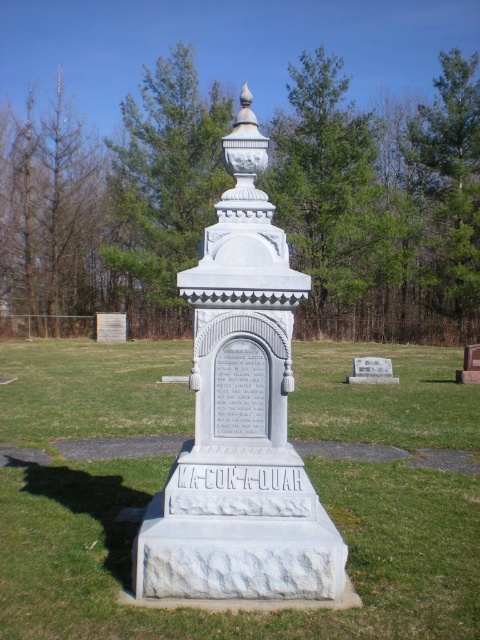
Based on the provided scene description, what are the coordinates of the green grass at center?

The green grass at center is located at coordinates point (240, 612).

You are standing in a cemetery and want to place a small bouquet of flowers on the ground near the white stone monument at center. Since the green grass at center is taller than the monument, will the flowers be easily visible from above once placed there?

The green grass at center is taller than the white stone monument at center, so the flowers placed there may be partially hidden by the grass and might not be easily visible from above.